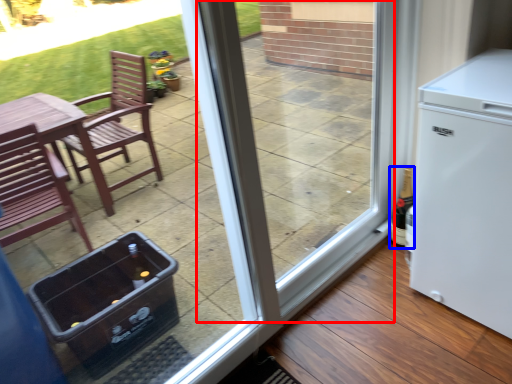
Question: Among these objects, which one is nearest to the camera, screen door (highlighted by a red box) or bottle (highlighted by a blue box)?

Choices:
 (A) screen door
 (B) bottle

Answer: (A)